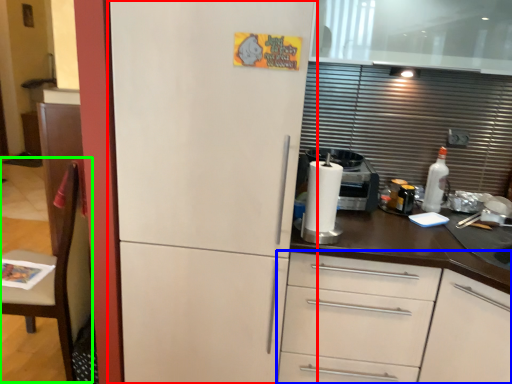
Question: Based on their relative distances, which object is nearer to refrigerator (highlighted by a red box)? Choose from cabinetry (highlighted by a blue box) and chair (highlighted by a green box).

Choices:
 (A) cabinetry
 (B) chair

Answer: (A)